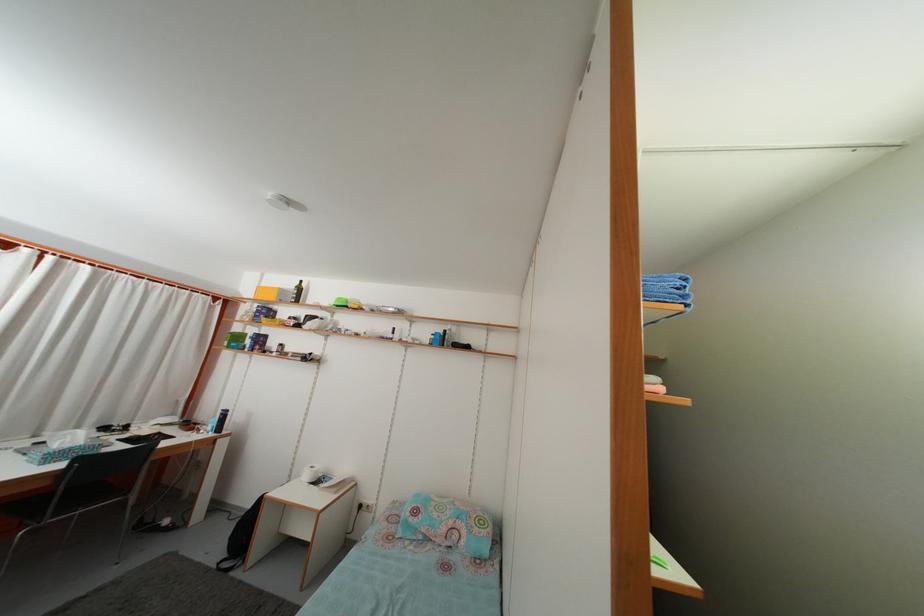
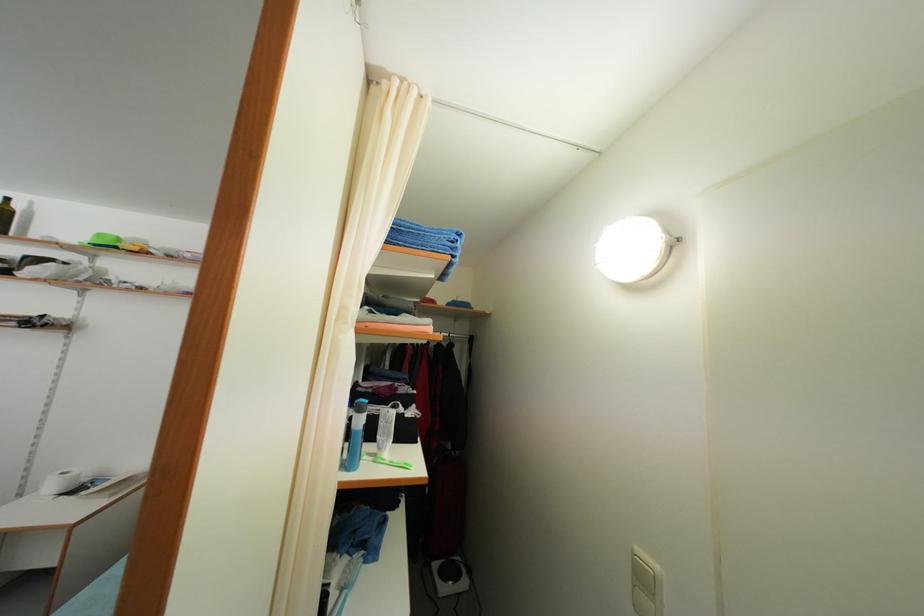
Locate, in the second image, the point that corresponds to (312,484) in the first image.

(56, 493)